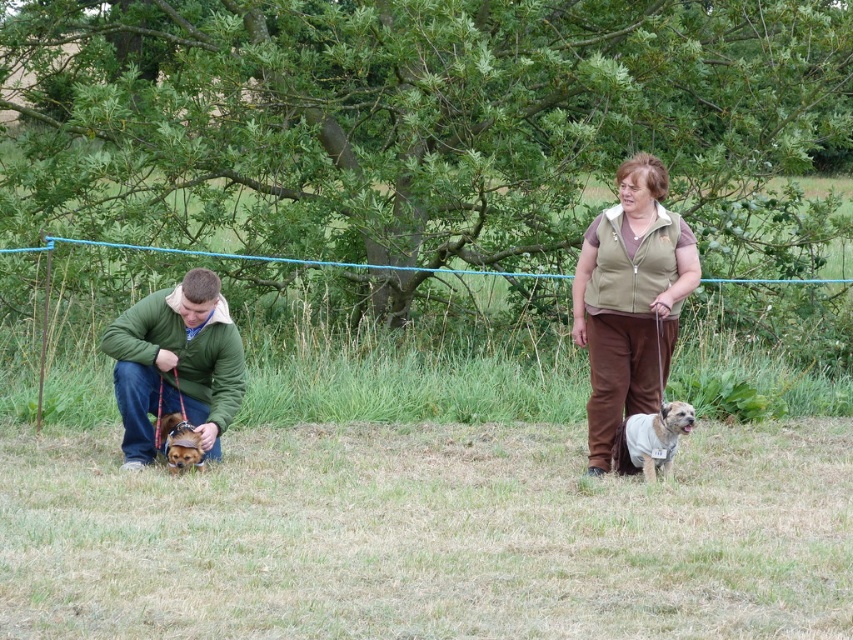
Can you confirm if brown fleece vest at center is positioned below light brown fur at center?

No.

Between brown fleece vest at center and light brown fur at center, which one appears on the right side from the viewer's perspective?

Positioned to the right is light brown fur at center.

Between point (602, 305) and point (619, 445), which one is positioned in front?

Point (602, 305) is in front.

This screenshot has width=853, height=640. Identify the location of brown fleece vest at center. (630, 300).

Who is shorter, green grass at lower center or brown furry dog at lower left?

green grass at lower center

Who is more forward, (633,630) or (177,448)?

Point (633,630) is more forward.

I want to click on green grass at lower center, so click(428, 536).

Does green grass at lower center appear on the left side of brown fleece vest at center?

Indeed, green grass at lower center is positioned on the left side of brown fleece vest at center.

Which is in front, point (12, 497) or point (642, 244)?

Point (12, 497) is more forward.

The width and height of the screenshot is (853, 640). I want to click on green grass at lower center, so click(x=428, y=536).